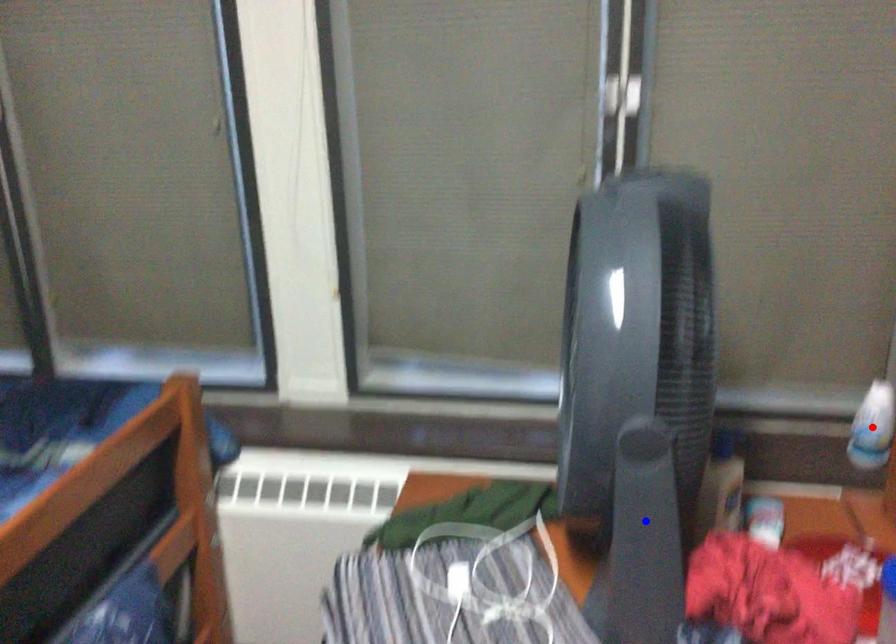
Question: Two points are marked on the image. Which point is closer to the camera?

Choices:
 (A) Blue point is closer.
 (B) Red point is closer.

Answer: (A)